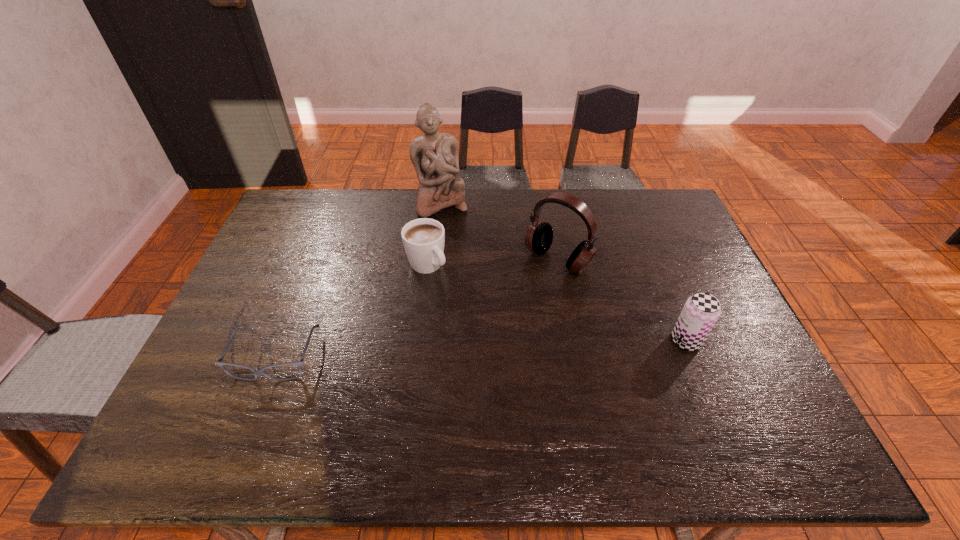
The image size is (960, 540). Identify the location of blank space located on the ear pads of the second object from right to left. (469, 347).

The image size is (960, 540). Identify the location of free region located on the ear pads of the second object from right to left. (469, 347).

Locate an element on the screen. vacant space situated 0.340m on the ear pads of the second object from right to left is located at coordinates (468, 349).

This screenshot has width=960, height=540. In order to click on vacant region located 0.390m on the front-facing side of the figurine in this screenshot , I will do `click(475, 301)`.

Identify the location of vacant space located 0.330m on the front-facing side of the figurine. This screenshot has height=540, width=960. (469, 286).

You are a GUI agent. You are given a task and a screenshot of the screen. Output one action in this format:
    pyautogui.click(x=<x>, y=<y>)
    Task: Click on the free region located on the front-facing side of the figurine
    This screenshot has width=960, height=540.
    Given the screenshot: What is the action you would take?
    pyautogui.click(x=469, y=284)

At what (x,y) coordinates should I click in order to perform the action: click on vacant point located 0.190m with the handle on the side of the cappuccino. Please return your answer as a coordinate pair (x, y). Image resolution: width=960 pixels, height=540 pixels. Looking at the image, I should click on (477, 317).

This screenshot has height=540, width=960. What are the coordinates of `free location located with the handle on the side of the cappuccino` in the screenshot? It's located at (505, 345).

Where is `free location located with the handle on the side of the cappuccino`? The width and height of the screenshot is (960, 540). free location located with the handle on the side of the cappuccino is located at coordinates (500, 340).

Where is `object present at the far edge`? object present at the far edge is located at coordinates (434, 155).